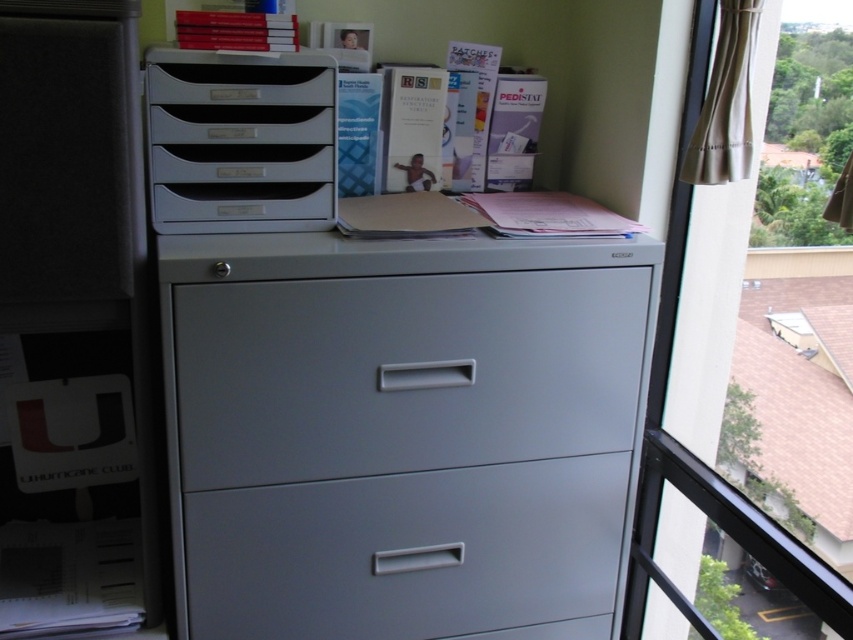
Does gray matte/file cabinet at center have a greater width compared to metallic gray drawer at center?

Indeed, gray matte/file cabinet at center has a greater width compared to metallic gray drawer at center.

Does point (408, 403) come behind point (190, 332)?

Yes, point (408, 403) is farther from viewer.

You are a GUI agent. You are given a task and a screenshot of the screen. Output one action in this format:
    pyautogui.click(x=<x>, y=<y>)
    Task: Click on the gray matte/file cabinet at center
    The height and width of the screenshot is (640, 853).
    Given the screenshot: What is the action you would take?
    pyautogui.click(x=402, y=433)

Between point (671, 275) and point (224, 108), which one is positioned in front?

Point (224, 108)

Is transparent glass window at right thinner than matte plastic file cabinet at upper left?

Yes, transparent glass window at right is thinner than matte plastic file cabinet at upper left.

The image size is (853, 640). I want to click on transparent glass window at right, so click(705, 412).

Describe the element at coordinates (402, 433) in the screenshot. I see `gray matte/file cabinet at center` at that location.

Who is shorter, gray matte/file cabinet at center or satin gray drawer at center?

satin gray drawer at center is shorter.

You are a GUI agent. You are given a task and a screenshot of the screen. Output one action in this format:
    pyautogui.click(x=<x>, y=<y>)
    Task: Click on the gray matte/file cabinet at center
    
    Given the screenshot: What is the action you would take?
    pyautogui.click(x=402, y=433)